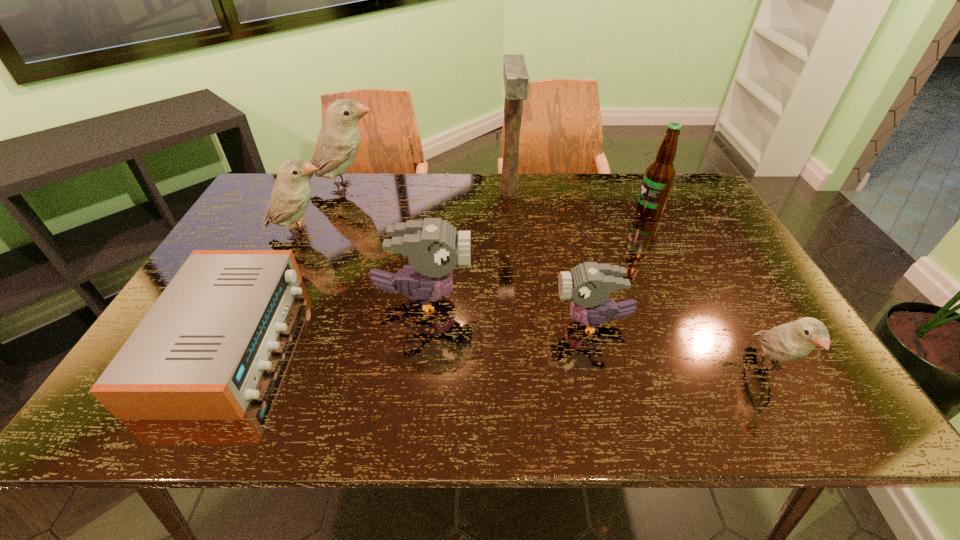
Where is `bird positioned at the near edge`? The image size is (960, 540). bird positioned at the near edge is located at coordinates (791, 341).

Locate an element on the screen. radio receiver situated at the near edge is located at coordinates (198, 354).

Find the location of a particular element. Image resolution: width=960 pixels, height=540 pixels. radio receiver that is positioned at the left edge is located at coordinates (198, 354).

Where is `beer bottle located in the right edge section of the desktop`? The image size is (960, 540). beer bottle located in the right edge section of the desktop is located at coordinates (658, 180).

Identify the location of bird located in the right edge section of the desktop. The image size is (960, 540). click(x=791, y=341).

Where is `object that is positioned at the far left corner`? Image resolution: width=960 pixels, height=540 pixels. object that is positioned at the far left corner is located at coordinates (338, 142).

This screenshot has width=960, height=540. In order to click on object located at the near left corner in this screenshot , I will do `click(198, 354)`.

Identify the location of object present at the far right corner. The image size is (960, 540). (658, 180).

Identify the location of object situated at the near right corner. This screenshot has height=540, width=960. (791, 341).

The image size is (960, 540). In order to click on vacant space at the far edge of the desktop in this screenshot , I will do `click(479, 184)`.